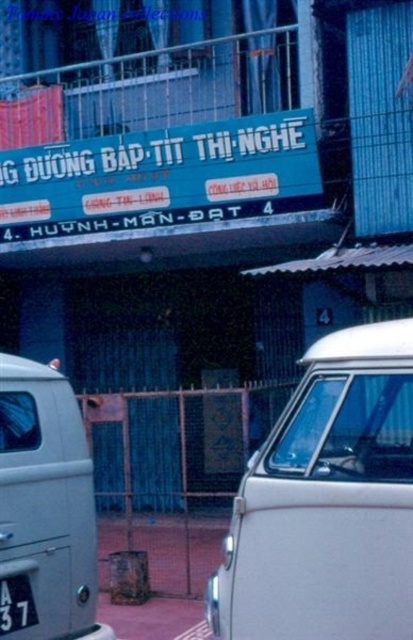
Who is higher up, white matte van at center or silver metallic van at left?

Positioned higher is white matte van at center.

Which is below, white matte van at center or silver metallic van at left?

Positioned lower is silver metallic van at left.

Which is behind, point (332, 488) or point (9, 436)?

Positioned behind is point (9, 436).

Image resolution: width=413 pixels, height=640 pixels. Identify the location of white matte van at center. (327, 502).

Between white matte van at center and black metal license plate at lower left, which one appears on the left side from the viewer's perspective?

black metal license plate at lower left

The width and height of the screenshot is (413, 640). Find the location of `white matte van at center`. white matte van at center is located at coordinates (327, 502).

At what (x,y) coordinates should I click in order to perform the action: click on white matte van at center. Please return your answer as a coordinate pair (x, y). This screenshot has width=413, height=640. Looking at the image, I should click on (327, 502).

Does silver metallic van at left appear over black metal license plate at lower left?

Correct, silver metallic van at left is located above black metal license plate at lower left.

Between silver metallic van at left and black metal license plate at lower left, which one is positioned lower?

black metal license plate at lower left is below.

Image resolution: width=413 pixels, height=640 pixels. In order to click on silver metallic van at left in this screenshot , I will do `click(45, 508)`.